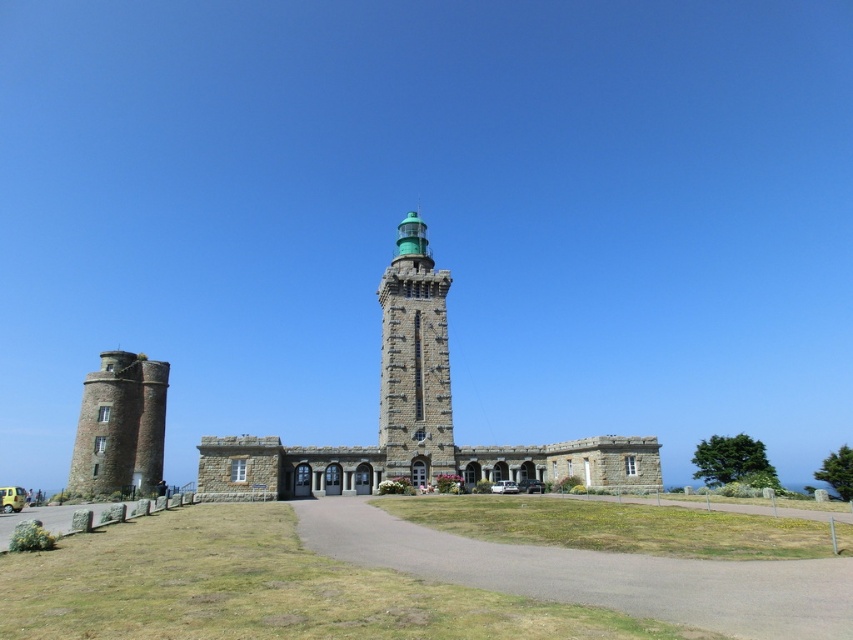
You are standing at the base of the historic stone structure and want to reach the entrance of the main building. According to the image, where is the gravel path at center located in relation to your current position?

The gravel path at center is located at point (596,573) in the image, so it is positioned to your right and slightly forward from your current position at the base.

You are a tourist standing at the base of the stone tower at left and want to reach the entrance of the main building. Which direction should you walk to avoid the green stone bell tower at center?

Since the green stone bell tower at center is to the right of the stone tower at left, you should walk to the left side of the stone tower at left to avoid it and head towards the entrance.

You are standing at the entrance of the historic stone lighthouse and want to walk to the green dome. There are two points marked on your map as point 1 at coordinates [676,609] and point 2 at [433,378]. Which point should you head towards first if you want to reach the green dome efficiently?

You should head towards point 1 at coordinates 0.954, 0.794 first because it is in front of point 2 at [433,378], meaning it is closer to your starting position at the entrance and thus the more efficient path towards the green dome.